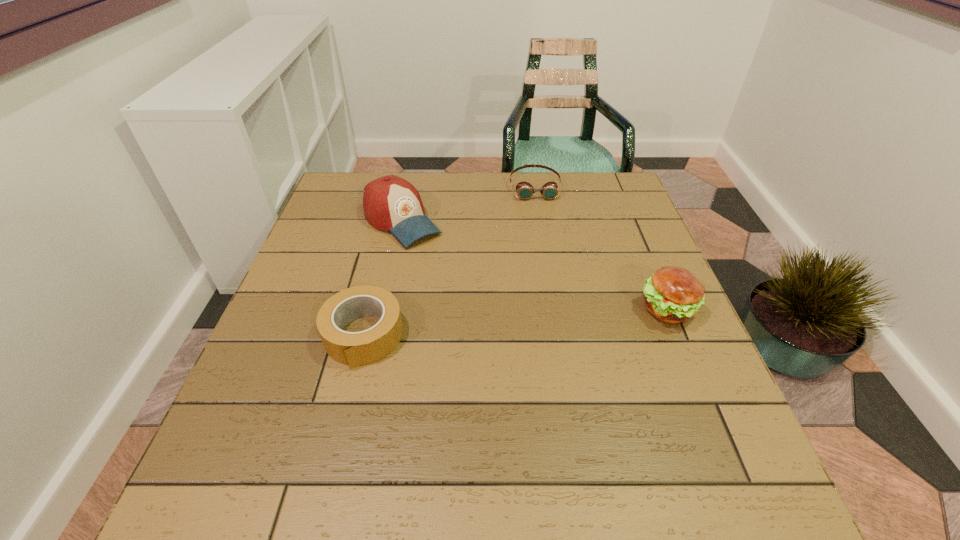
Find the location of a particular element. duct tape is located at coordinates point(354,349).

Image resolution: width=960 pixels, height=540 pixels. I want to click on hamburger, so click(x=673, y=294).

Locate an element on the screen. The height and width of the screenshot is (540, 960). baseball cap is located at coordinates (390, 203).

Locate an element on the screen. This screenshot has height=540, width=960. the second object from right to left is located at coordinates (525, 190).

This screenshot has height=540, width=960. Find the location of `the shortest object`. the shortest object is located at coordinates (525, 190).

The image size is (960, 540). Find the location of `free spot located 0.080m at the edge of the third tallest object`. free spot located 0.080m at the edge of the third tallest object is located at coordinates (346, 407).

Where is `vacant space located 0.070m on the back of the rightmost object`? The width and height of the screenshot is (960, 540). vacant space located 0.070m on the back of the rightmost object is located at coordinates (651, 269).

At what (x,y) coordinates should I click in order to perform the action: click on free region located 0.270m on the front-facing side of the baseball cap. Please return your answer as a coordinate pair (x, y). Looking at the image, I should click on (486, 305).

Locate an element on the screen. free spot located 0.250m on the front-facing side of the baseball cap is located at coordinates (481, 299).

Find the location of a particular element. This screenshot has height=540, width=960. vacant space situated 0.300m on the front-facing side of the baseball cap is located at coordinates (494, 312).